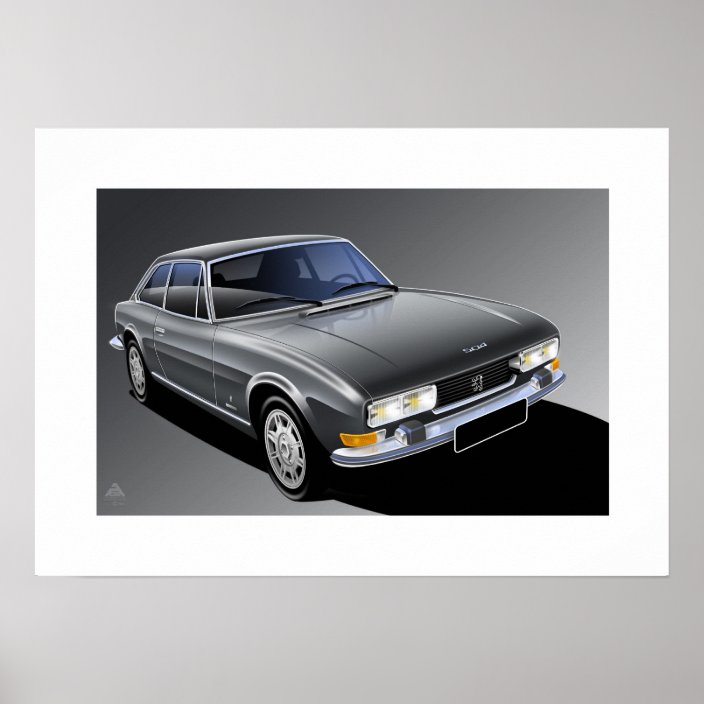
Image resolution: width=704 pixels, height=704 pixels. I want to click on light, so click(x=545, y=355).